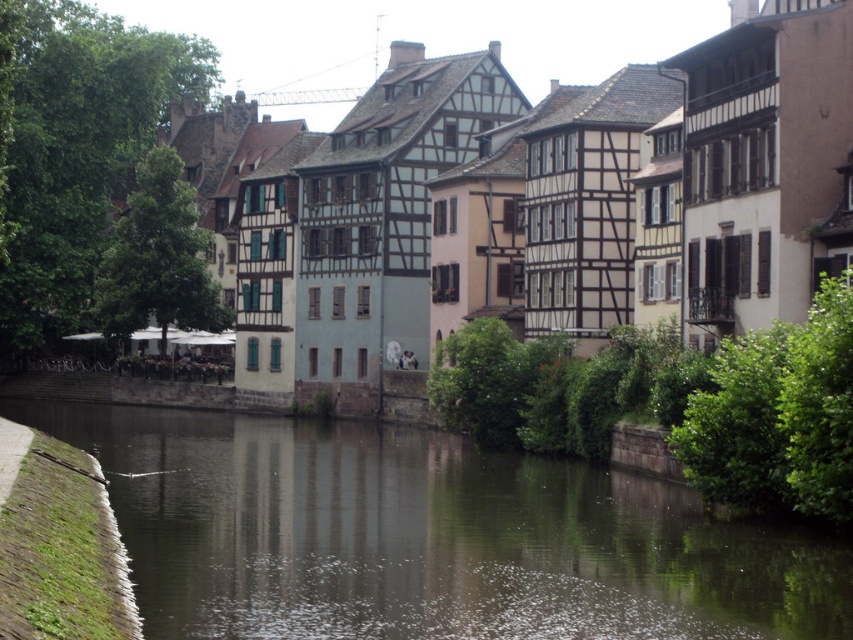
Question: Among these points, which one is nearest to the camera?

Choices:
 (A) (57, 490)
 (B) (273, 484)
 (C) (439, 266)

Answer: (A)

Question: Observing the image, what is the correct spatial positioning of dark brown water at center in reference to green mossy stone at lower left?

Choices:
 (A) left
 (B) right

Answer: (B)

Question: Which of these objects is positioned closest to the dark brown water at center?

Choices:
 (A) green mossy stone at lower left
 (B) wooden houses at center

Answer: (A)

Question: Considering the relative positions of wooden houses at center and green mossy stone at lower left in the image provided, where is wooden houses at center located with respect to green mossy stone at lower left?

Choices:
 (A) right
 (B) left

Answer: (A)

Question: Is dark brown water at center to the left of wooden houses at center from the viewer's perspective?

Choices:
 (A) no
 (B) yes

Answer: (A)

Question: Which is nearer to the wooden houses at center?

Choices:
 (A) dark brown water at center
 (B) green mossy stone at lower left

Answer: (A)